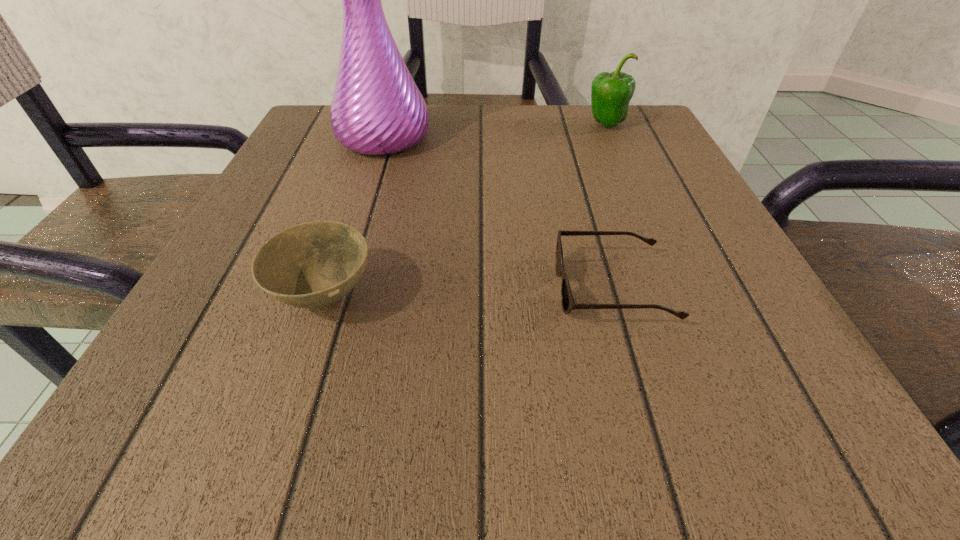
Locate an element on the screen. vacant space at the left edge of the desktop is located at coordinates (268, 319).

In the image, there is a desktop. What are the coordinates of `vacant space at the right edge` in the screenshot? It's located at (640, 286).

This screenshot has width=960, height=540. Find the location of `vacant space at the far left corner of the desktop`. vacant space at the far left corner of the desktop is located at coordinates (346, 150).

You are a GUI agent. You are given a task and a screenshot of the screen. Output one action in this format:
    pyautogui.click(x=<x>, y=<y>)
    Task: Click on the vacant position at the far right corner of the desktop
    
    Given the screenshot: What is the action you would take?
    pyautogui.click(x=629, y=140)

Identify the location of vacant space in between the bell pepper and the tallest object. (494, 131).

Where is `free area in between the bell pepper and the bowl`? The image size is (960, 540). free area in between the bell pepper and the bowl is located at coordinates (466, 210).

At what (x,y) coordinates should I click in order to perform the action: click on empty space between the vase and the second tallest object. Please return your answer as a coordinate pair (x, y). Looking at the image, I should click on (494, 131).

Find the location of a particular element. free spot between the bell pepper and the second shortest object is located at coordinates (466, 210).

At what (x,y) coordinates should I click in order to perform the action: click on free space between the bowl and the vase. Please return your answer as a coordinate pair (x, y). Looking at the image, I should click on (354, 217).

This screenshot has width=960, height=540. Find the location of `vacant space in between the vase and the second tallest object`. vacant space in between the vase and the second tallest object is located at coordinates (494, 131).